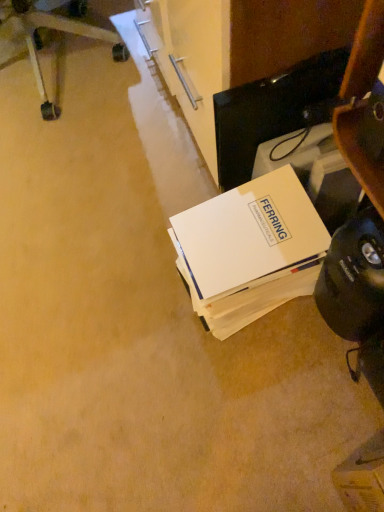
I want to click on white paper at lower right, so click(x=249, y=234).

What do you see at coordinates (249, 234) in the screenshot?
I see `white paper at lower right` at bounding box center [249, 234].

This screenshot has height=512, width=384. What are the coordinates of `white paper at lower right` in the screenshot? It's located at (249, 234).